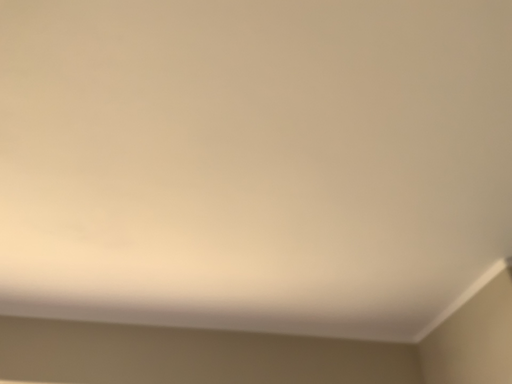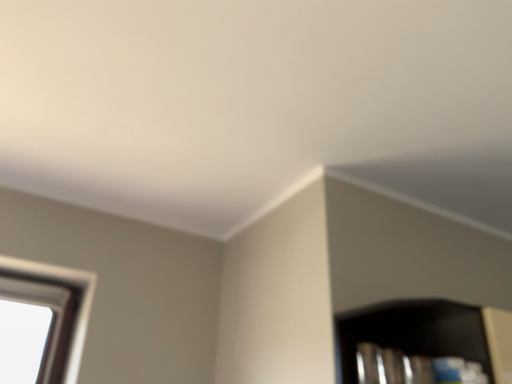
Question: Which way did the camera rotate in the video?

Choices:
 (A) rotated left
 (B) rotated right

Answer: (B)